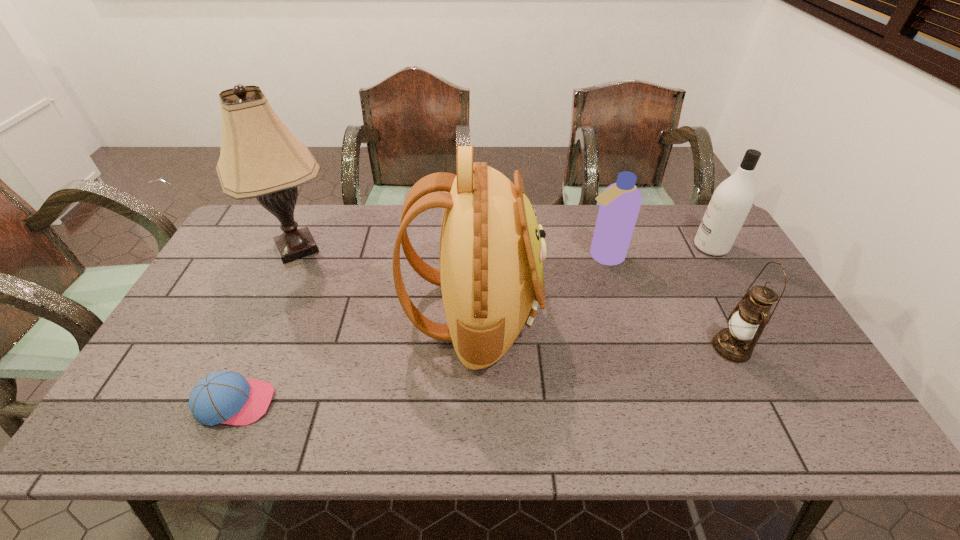
In order to click on free space located on the front-facing side of the right shampoo in this screenshot , I will do `click(645, 247)`.

I want to click on vacant position located on the front-facing side of the right shampoo, so click(593, 247).

Where is `vacant area situated 0.070m on the right of the third object from right to left`? vacant area situated 0.070m on the right of the third object from right to left is located at coordinates (647, 256).

At what (x,y) coordinates should I click in order to perform the action: click on free region located on the back of the oil lamp. Please return your answer as a coordinate pair (x, y). This screenshot has height=540, width=960. Looking at the image, I should click on (693, 272).

Identify the location of vacant area located 0.120m on the front-facing side of the baseball cap. The height and width of the screenshot is (540, 960). (324, 403).

Where is `lamp at the far edge`? The width and height of the screenshot is (960, 540). lamp at the far edge is located at coordinates (260, 158).

Where is `object positioned at the near edge`? The image size is (960, 540). object positioned at the near edge is located at coordinates (226, 397).

At what (x,y) coordinates should I click in order to perform the action: click on lamp present at the left edge. Please return your answer as a coordinate pair (x, y). Image resolution: width=960 pixels, height=540 pixels. Looking at the image, I should click on (260, 158).

This screenshot has height=540, width=960. Identify the location of baseball cap that is at the left edge. tap(226, 397).

Where is `shampoo situated at the right edge`? This screenshot has height=540, width=960. shampoo situated at the right edge is located at coordinates (x=732, y=200).